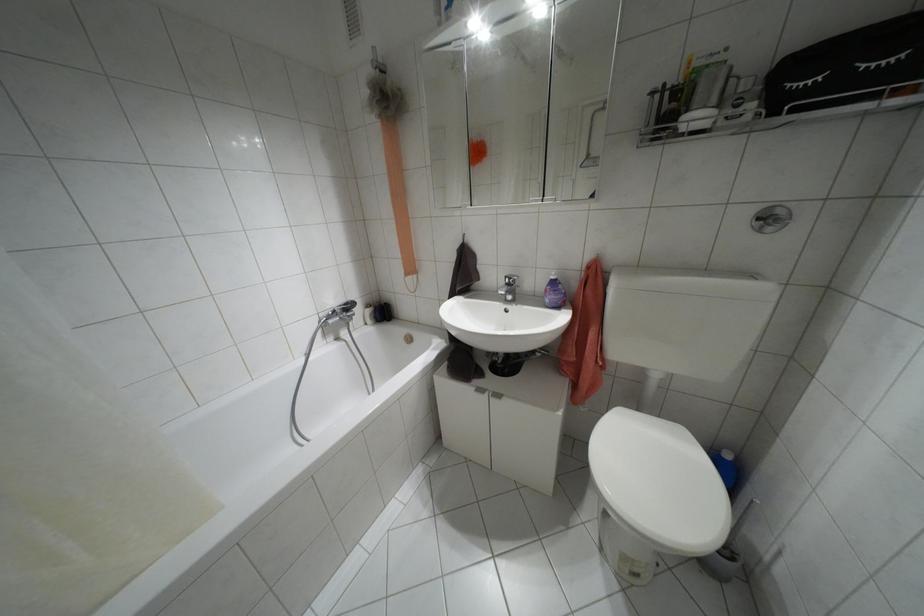
Which object does [847,68] point to?

It corresponds to the black toiletry bag in the image.